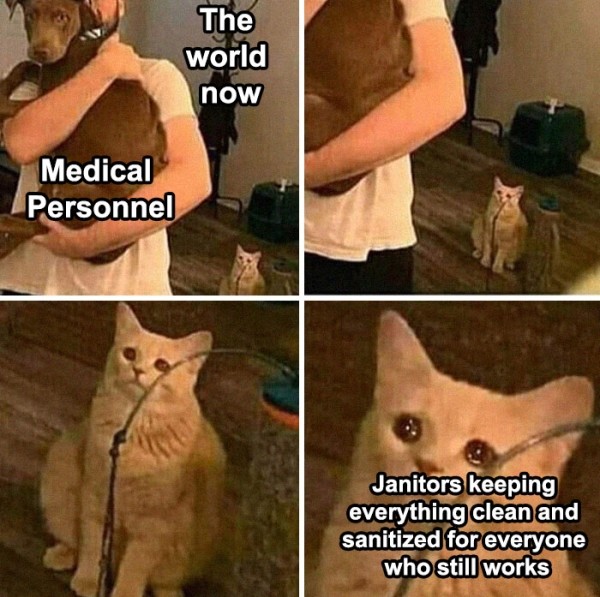
Find the location of a particular element. The height and width of the screenshot is (597, 600). pet carrier that is black is located at coordinates (x=554, y=136), (x=267, y=206).